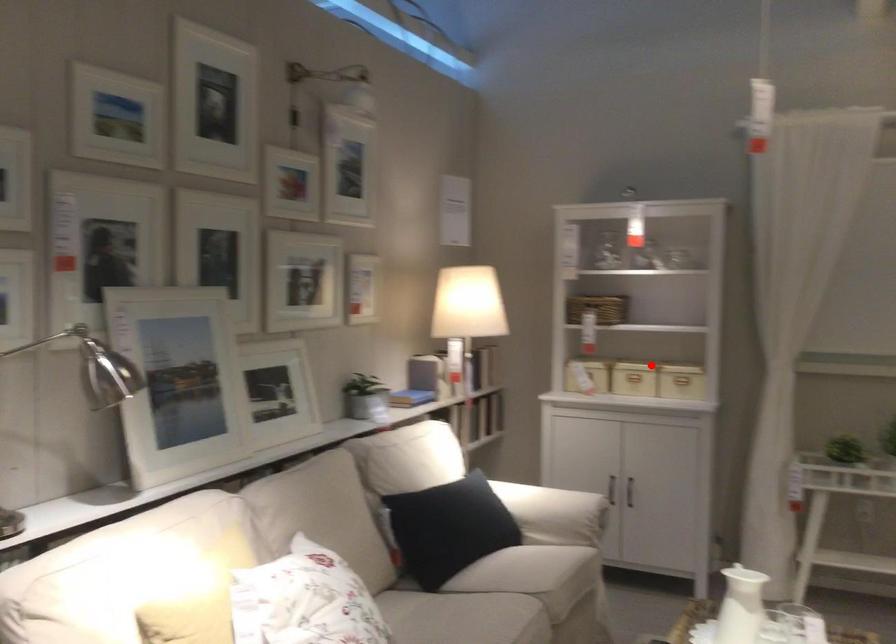
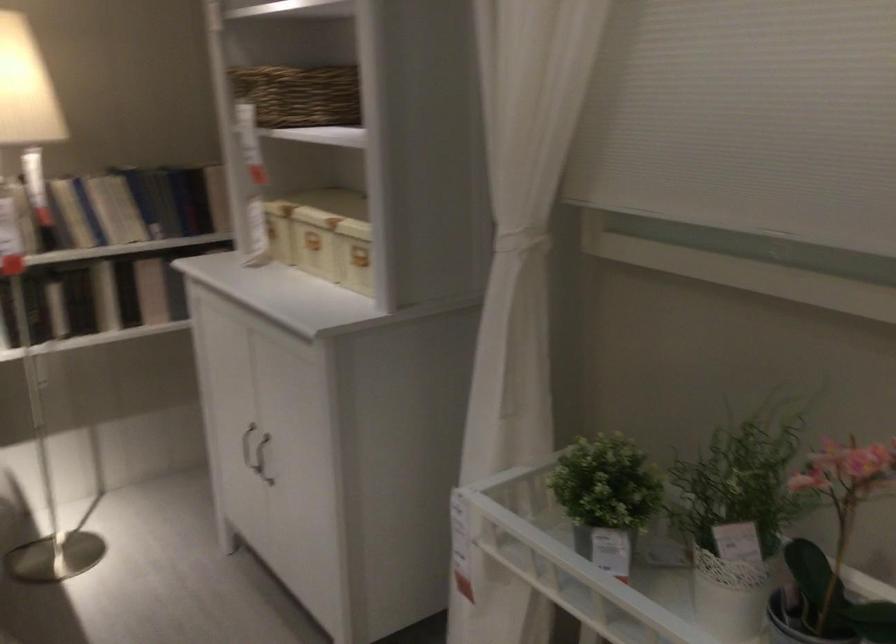
Question: I am providing you with two images of the same scene from different viewpoints. Given a red point in image1, look at the same physical point in image2. Is it:

Choices:
 (A) Closer to the viewpoint
 (B) Farther from the viewpoint

Answer: (A)